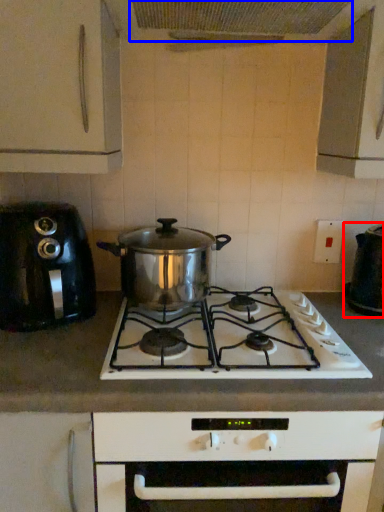
Question: Which object is closer to the camera taking this photo, kitchen appliance (highlighted by a red box) or exhaust hood (highlighted by a blue box)?

Choices:
 (A) kitchen appliance
 (B) exhaust hood

Answer: (B)